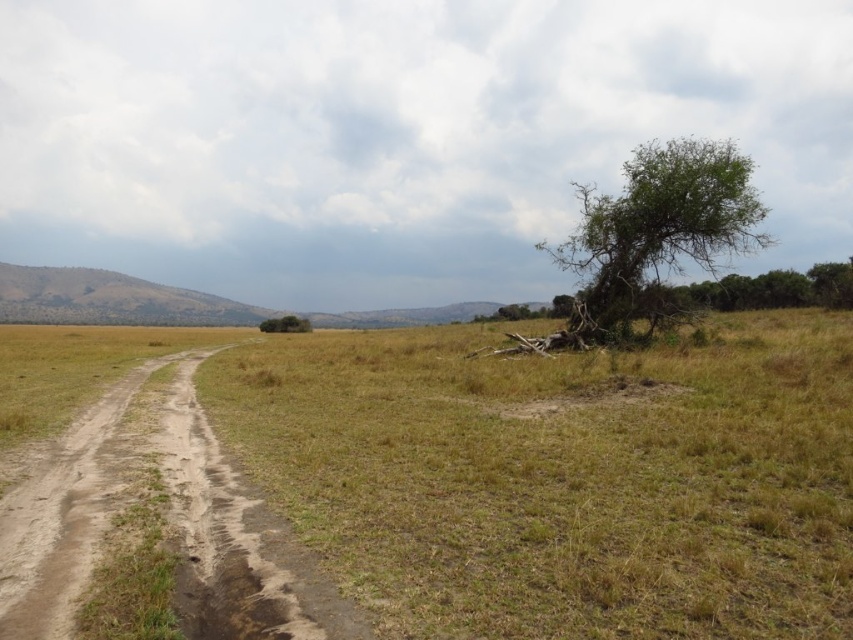
Question: Which point appears farthest from the camera in this image?

Choices:
 (A) pyautogui.click(x=306, y=328)
 (B) pyautogui.click(x=683, y=218)

Answer: (A)

Question: Among these objects, which one is farthest from the camera?

Choices:
 (A) green leafy tree at center
 (B) brown dirt path at left

Answer: (A)

Question: In this image, where is dry grass at center located relative to brown dirt path at left?

Choices:
 (A) above
 (B) below

Answer: (A)

Question: Which point is closer to the camera taking this photo?

Choices:
 (A) (20, 534)
 (B) (641, 308)
 (C) (717, 554)
 (D) (282, 330)

Answer: (C)

Question: Is dry grass at center to the right of green leafy tree at upper right from the viewer's perspective?

Choices:
 (A) no
 (B) yes

Answer: (A)

Question: Does dry grass at center appear over brown dirt path at left?

Choices:
 (A) yes
 (B) no

Answer: (A)